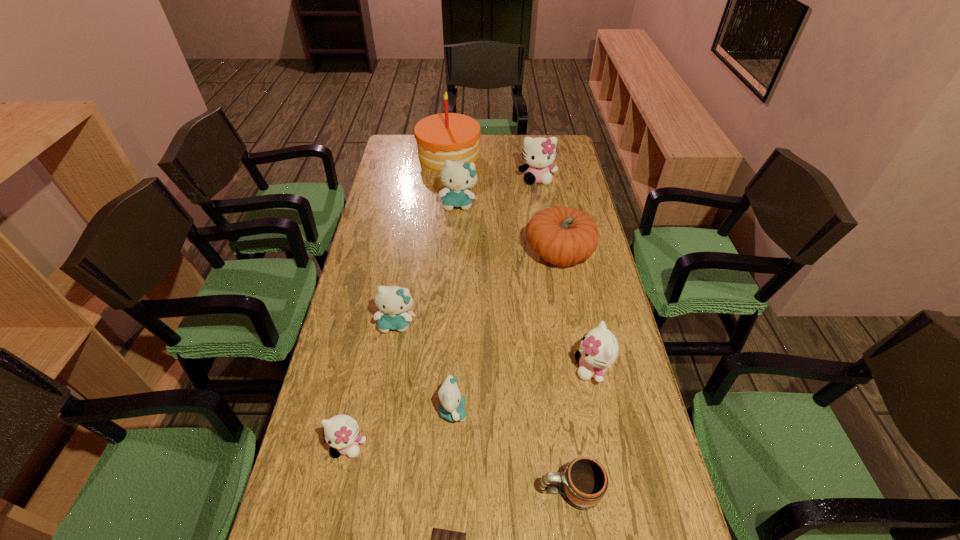
At what (x,y) coordinates should I click in order to perform the action: click on free region located 0.240m on the side of the second shortest object with the handle. Please return your answer as a coordinate pair (x, y). Looking at the image, I should click on (433, 490).

Identify the location of object at the far edge. (446, 136).

The image size is (960, 540). In order to click on birthday cake present at the left edge in this screenshot , I will do `click(446, 136)`.

This screenshot has height=540, width=960. In order to click on pumpkin present at the right edge in this screenshot , I will do `click(563, 236)`.

The image size is (960, 540). What are the coordinates of `mug situated at the right edge` in the screenshot? It's located at (584, 481).

The width and height of the screenshot is (960, 540). Find the location of `object that is at the far left corner`. object that is at the far left corner is located at coordinates (446, 136).

The height and width of the screenshot is (540, 960). What are the coordinates of `vacant position at the left edge of the desktop` in the screenshot? It's located at (376, 423).

Identify the location of vacant space at the right edge of the desktop. This screenshot has height=540, width=960. (578, 208).

In the image, there is a desktop. Where is `free region at the far left corner`? This screenshot has height=540, width=960. free region at the far left corner is located at coordinates (394, 156).

Locate an element on the screen. vacant area that lies between the tallest object and the mug is located at coordinates (509, 322).